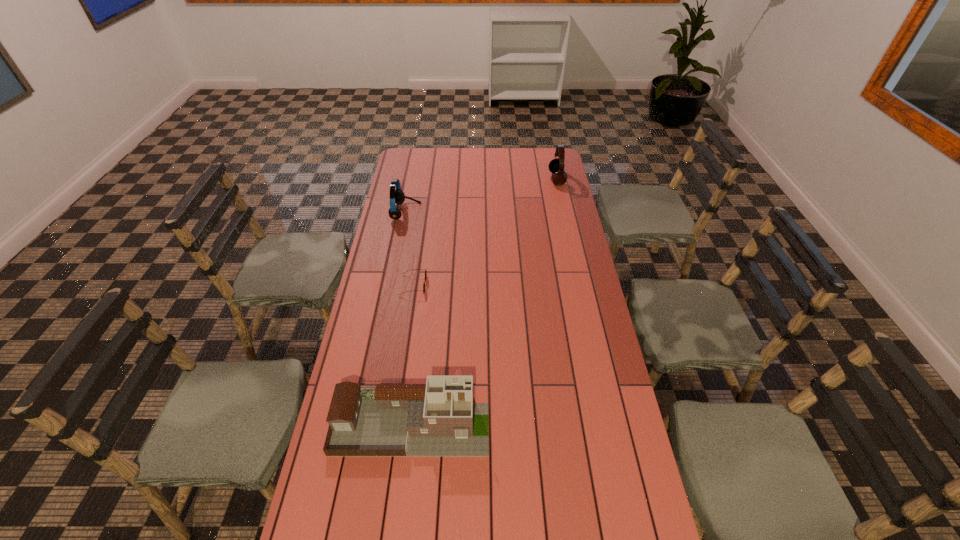
Identify the location of free space at the left edge of the desktop. (323, 500).

At what (x,y) coordinates should I click in order to perform the action: click on free space at the right edge of the desktop. Please return your answer as a coordinate pair (x, y). This screenshot has height=540, width=960. Looking at the image, I should click on (626, 530).

This screenshot has width=960, height=540. I want to click on free space between the third farthest object and the nearest object, so click(x=412, y=355).

At what (x,y) coordinates should I click in order to perform the action: click on vacant space that is in between the dollhouse and the left headset. Please return your answer as a coordinate pair (x, y). The height and width of the screenshot is (540, 960). Looking at the image, I should click on (408, 318).

I want to click on vacant region between the farthest object and the dollhouse, so click(484, 302).

The height and width of the screenshot is (540, 960). I want to click on vacant area that lies between the nearer headset and the shortest object, so click(x=410, y=248).

The image size is (960, 540). What are the coordinates of `free space between the shortest object and the second farthest object` in the screenshot? It's located at (410, 248).

Locate an element on the screen. The height and width of the screenshot is (540, 960). free space between the nearest object and the farther headset is located at coordinates coord(484,302).

The width and height of the screenshot is (960, 540). I want to click on free spot between the third nearest object and the nearest object, so click(408, 318).

The height and width of the screenshot is (540, 960). I want to click on vacant area between the sunglasses and the dollhouse, so coord(412,355).